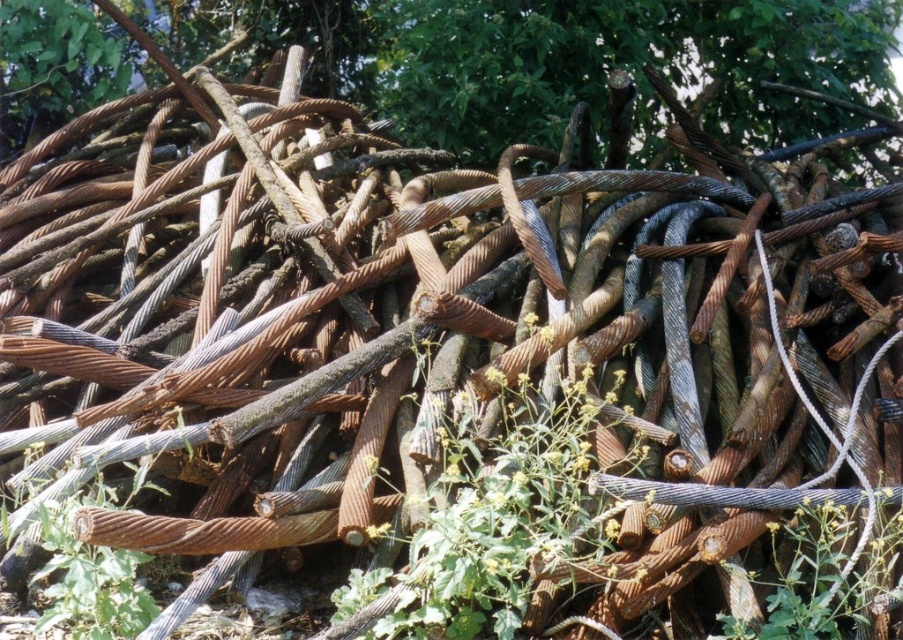
Question: Does brown textured wood at upper center have a larger size compared to green leafy plant at center?

Choices:
 (A) yes
 (B) no

Answer: (A)

Question: Can you confirm if brown textured wood at upper center is positioned above green leafy weed at center?

Choices:
 (A) no
 (B) yes

Answer: (B)

Question: Which point is farther to the camera?

Choices:
 (A) (832, 570)
 (B) (268, 28)

Answer: (B)

Question: Estimate the real-world distances between objects in this image. Which object is farther from the brown textured wood at upper center?

Choices:
 (A) green leafy plant at center
 (B) green leafy weed at center

Answer: (B)

Question: Does brown textured wood at upper center appear on the right side of green leafy weed at center?

Choices:
 (A) yes
 (B) no

Answer: (B)

Question: Which of the following is the closest to the observer?

Choices:
 (A) (807, 620)
 (B) (888, 4)
 (C) (427, 550)

Answer: (A)